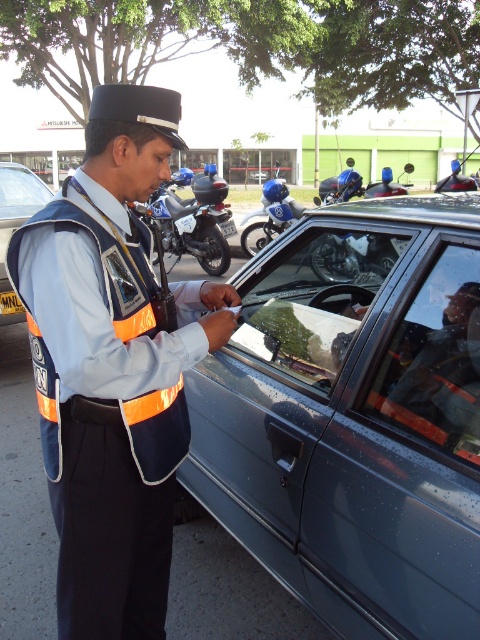
You are a pedestrian standing on the sidewalk. You see a metallic gray car at center and a transparent glass windshield at center. Which object is closer to you?

The transparent glass windshield at center is closer to you because the metallic gray car at center is positioned under it.